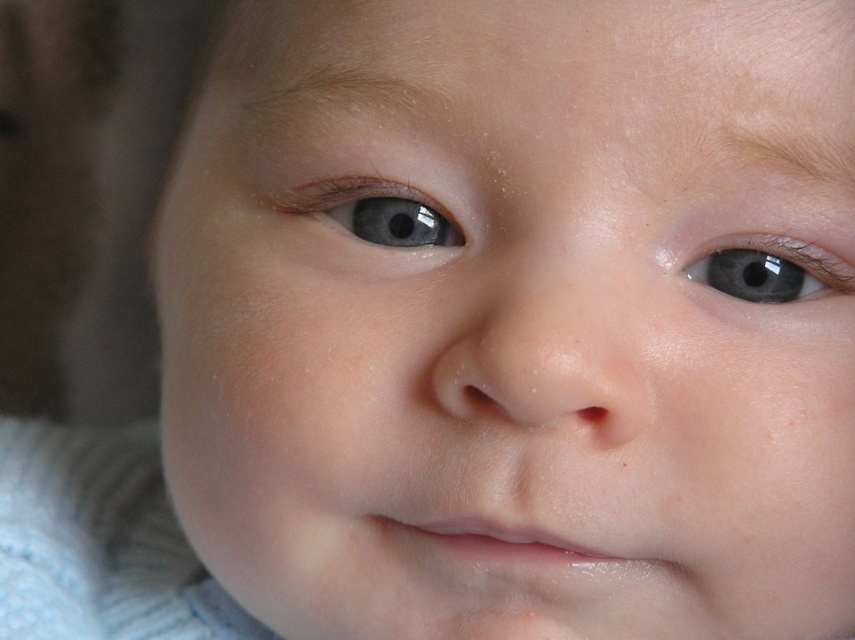
Can you confirm if blue glossy eye at center is shorter than blue glossy eye at upper right?

No.

Is point (325, 198) farther from camera compared to point (730, 296)?

Yes, point (325, 198) is farther from viewer.

Where is `blue glossy eye at center`? The width and height of the screenshot is (855, 640). blue glossy eye at center is located at coordinates (379, 211).